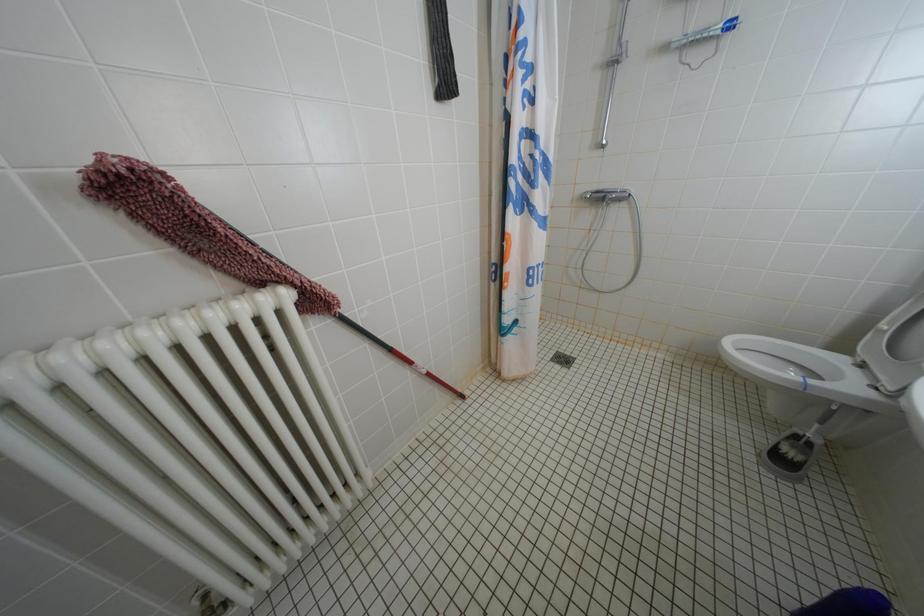
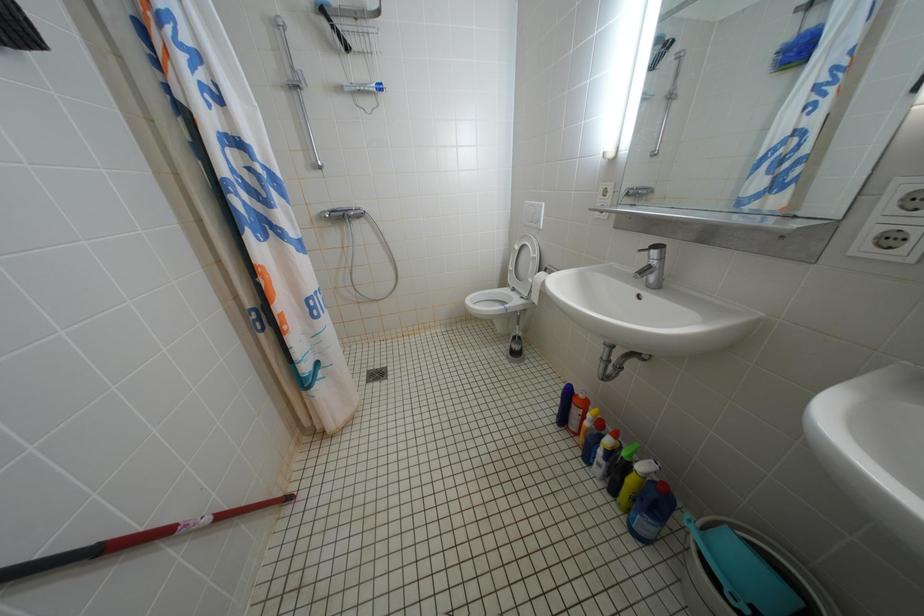
Question: The camera is either moving clockwise (left) or counter-clockwise (right) around the object. The first image is from the beginning of the video and the second image is from the end. Is the camera moving left or right when shooting the video?

Choices:
 (A) Left
 (B) Right

Answer: (A)